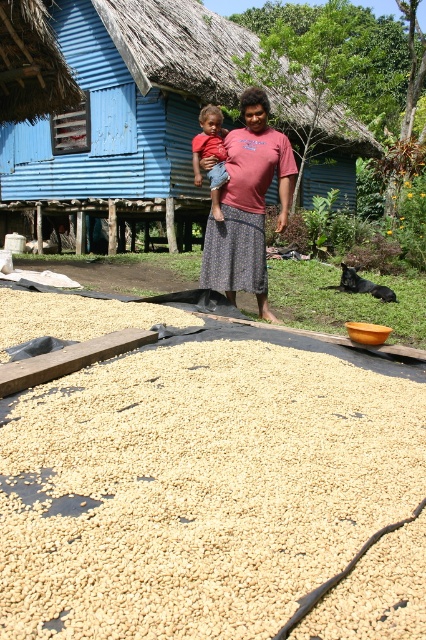
Based on the scene description, if you were standing at the position of the blue corrugated metal hut at upper left, which direction would the matte pink shirt at center be relative to you?

The matte pink shirt at center is to the right of the blue corrugated metal hut at upper left.

You are standing in the rural outdoor scene and want to place a small flag at the point closer to you between point (235, 192) and point (222, 182). Which point should you choose?

You should choose point (235, 192) because it is closer to the viewer than point (222, 182).